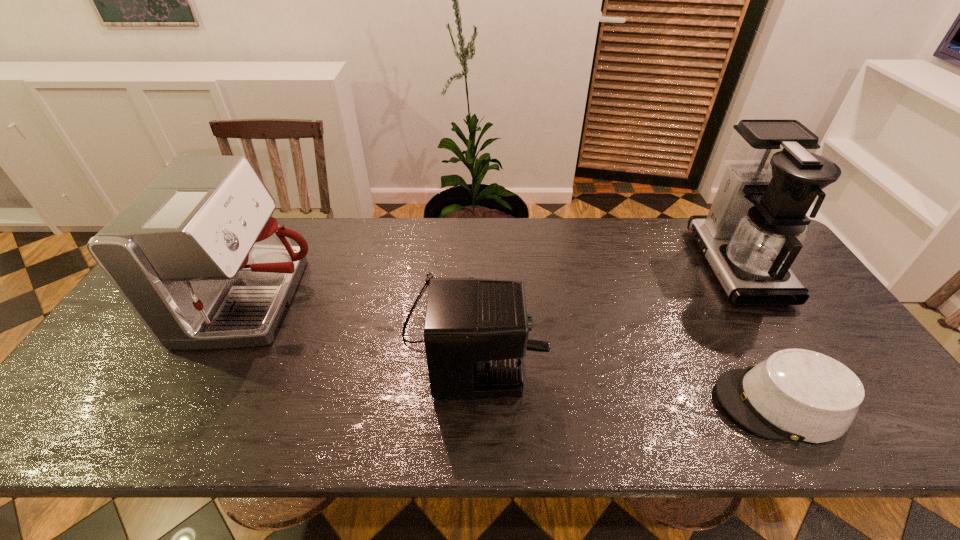
Image resolution: width=960 pixels, height=540 pixels. Identify the location of free space at the far edge of the desktop. (636, 221).

Image resolution: width=960 pixels, height=540 pixels. What are the coordinates of `vacant space at the near edge of the desktop` in the screenshot? It's located at (148, 421).

Identify the location of free space between the third tallest object and the rightmost coffee maker. The image size is (960, 540). (604, 298).

I want to click on free space that is in between the rightmost coffee maker and the second coffee maker from left to right, so click(x=604, y=298).

At what (x,y) coordinates should I click in order to perform the action: click on unoccupied area between the leftmost object and the second coffee maker from left to right. Please return your answer as a coordinate pair (x, y). The image size is (960, 540). Looking at the image, I should click on (364, 315).

Identify the location of free space between the rightmost coffee maker and the hat. (757, 334).

You are a GUI agent. You are given a task and a screenshot of the screen. Output one action in this format:
    pyautogui.click(x=<x>, y=<y>)
    Task: Click on the vacant space that is in between the shortest object and the third object from right to left
    Image resolution: width=960 pixels, height=540 pixels.
    Given the screenshot: What is the action you would take?
    pyautogui.click(x=626, y=367)

Point out which object is positioned as the nearest to the rightmost coffee maker. Please provide its 2D coordinates. Your answer should be formatted as a tuple, i.e. [(x, y)], where the tuple contains the x and y coordinates of a point satisfying the conditions above.

[(800, 395)]

Where is `the second closest object to the leftmost object`? the second closest object to the leftmost object is located at coordinates (800, 395).

This screenshot has width=960, height=540. What are the coordinates of `coffee maker that is the second closest to the shortest object` in the screenshot? It's located at (476, 331).